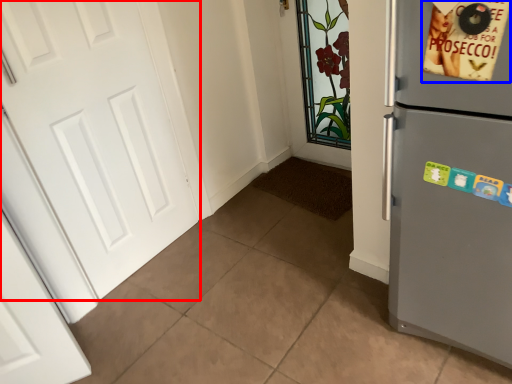
Question: Which object is closer to the camera taking this photo, door (highlighted by a red box) or postcard (highlighted by a blue box)?

Choices:
 (A) door
 (B) postcard

Answer: (B)